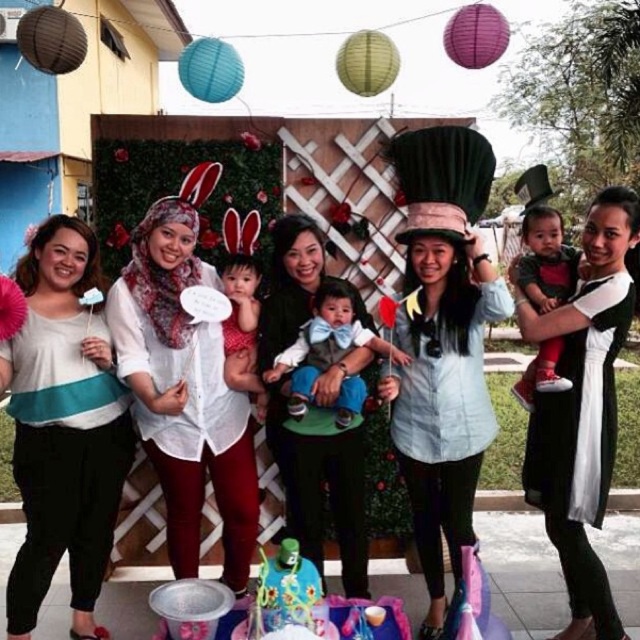
Question: Which point appears farthest from the camera in this image?

Choices:
 (A) (241, 312)
 (B) (468, 244)

Answer: (A)

Question: Can you confirm if white sheer dress at center is positioned to the left of light brown fabric baby at center?

Choices:
 (A) no
 (B) yes

Answer: (A)

Question: Which object is the closest to the white matte shirt at left?

Choices:
 (A) white sheer dress at center
 (B) denim shirt at center
 (C) white matte scarf at center

Answer: (C)

Question: Does denim shirt at center have a greater width compared to matte white shirt at center?

Choices:
 (A) no
 (B) yes

Answer: (B)

Question: Does white matte scarf at center have a greater width compared to denim shirt at center?

Choices:
 (A) no
 (B) yes

Answer: (B)

Question: Which point appears farthest from the camera in this image?

Choices:
 (A) (230, 268)
 (B) (538, 236)
 (C) (368, 358)
 (D) (83, 314)

Answer: (A)